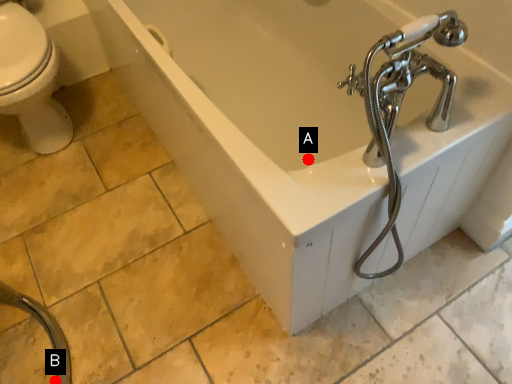
Question: Two points are circled on the image, labeled by A and B beside each circle. Which point is closer to the camera?

Choices:
 (A) A is closer
 (B) B is closer

Answer: (B)